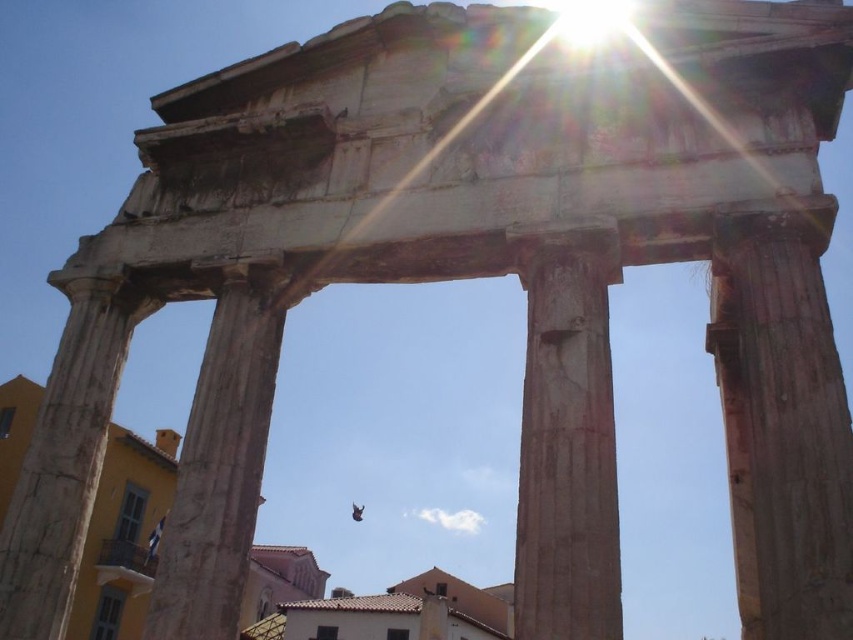
Question: Where is smooth stone column at right located in relation to smooth stone pillar at left in the image?

Choices:
 (A) left
 (B) right

Answer: (B)

Question: Among these objects, which one is farthest from the camera?

Choices:
 (A) brown stone column at center
 (B) smooth stone pillar at left
 (C) smooth stone column at right
 (D) smooth stone column at center

Answer: (B)

Question: Among these points, which one is farthest from the camera?

Choices:
 (A) (x=80, y=449)
 (B) (x=556, y=342)

Answer: (A)

Question: From the image, what is the correct spatial relationship of smooth stone column at center in relation to smooth stone pillar at left?

Choices:
 (A) right
 (B) left

Answer: (A)

Question: Can you confirm if smooth stone column at right is smaller than smooth stone pillar at left?

Choices:
 (A) no
 (B) yes

Answer: (A)

Question: Considering the real-world distances, which object is closest to the smooth stone pillar at left?

Choices:
 (A) smooth stone column at right
 (B) smooth stone column at center
 (C) brown stone column at center

Answer: (B)